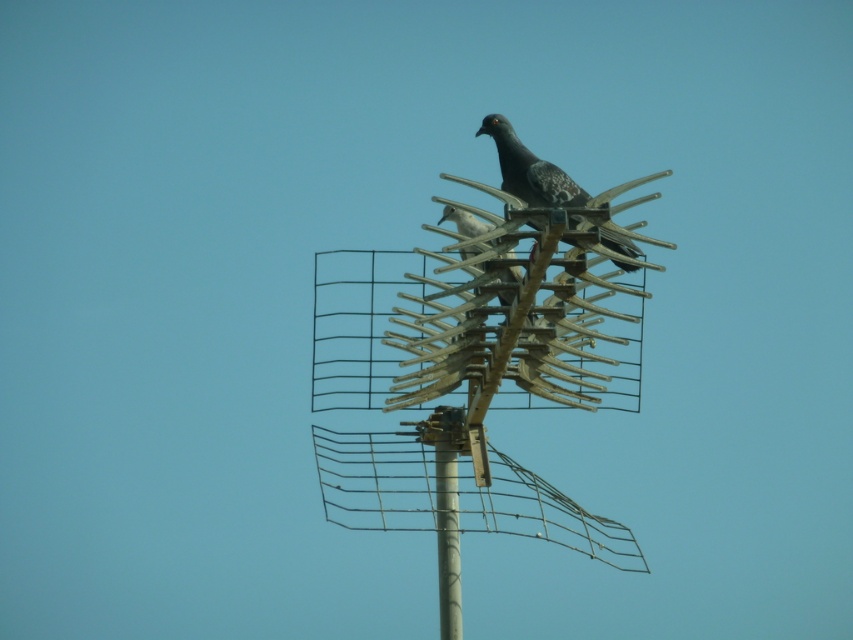
What are the coordinates of the speckled feathered bird at center?

The speckled feathered bird at center is located at coordinates point (529, 170).

You are a birdwatcher trying to identify birds on a bird deterrent device. You notice two birds there. The first is a speckled feathered bird at center and the second is a speckled feathered pigeon at center. Which of the two birds is taller?

The speckled feathered bird at center is much taller than the speckled feathered pigeon at center.

You are a birdwatcher trying to observe both birds in the scene. Which bird is more visible to you, the speckled feathered bird at center or the speckled feathered pigeon at center?

The speckled feathered bird at center is more visible because it is closer to the viewer than the speckled feathered pigeon at center.